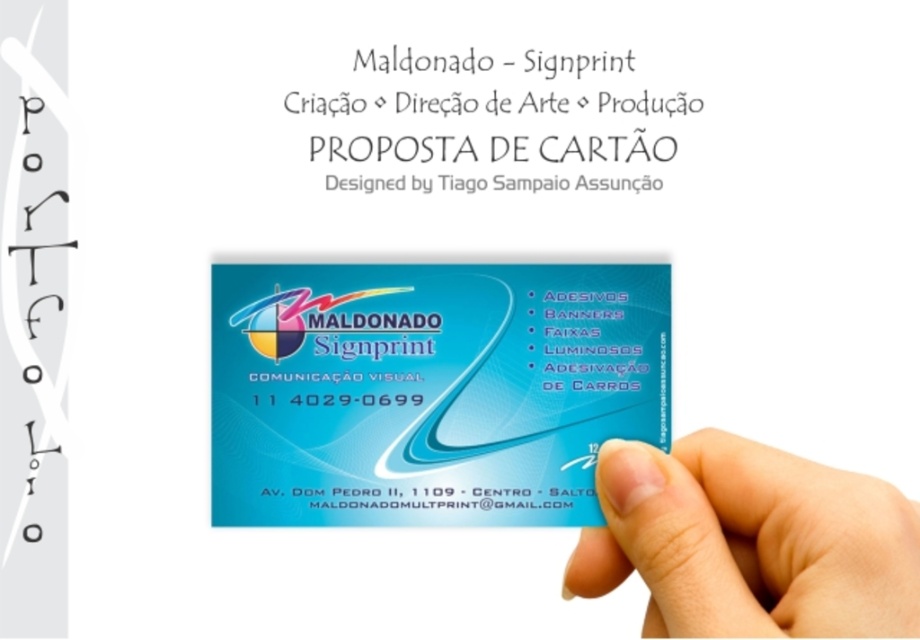
Question: Which point is closer to the camera?

Choices:
 (A) matte blue card at lower right
 (B) white paper at upper center
 (C) blue glossy text at bottom center

Answer: (A)

Question: Does white paper at upper center have a larger size compared to blue glossy text at bottom center?

Choices:
 (A) no
 (B) yes

Answer: (B)

Question: Does blue glossy business card at center appear on the right side of white paper at upper center?

Choices:
 (A) yes
 (B) no

Answer: (B)

Question: Is white paper at upper center below blue glossy text at bottom center?

Choices:
 (A) yes
 (B) no

Answer: (B)

Question: Among these objects, which one is farthest from the camera?

Choices:
 (A) white paper at upper center
 (B) matte blue card at lower right

Answer: (A)

Question: Among these objects, which one is farthest from the camera?

Choices:
 (A) matte blue card at lower right
 (B) blue glossy text at bottom center

Answer: (B)